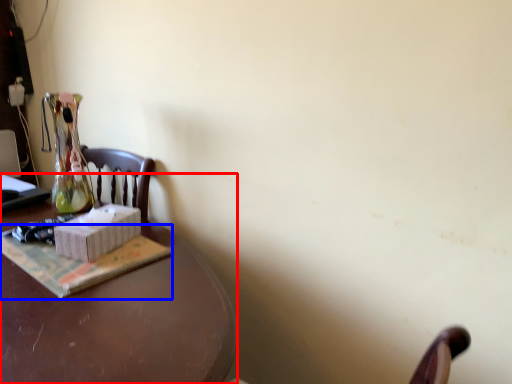
Question: Among these objects, which one is nearest to the camera, desk (highlighted by a red box) or paperback book (highlighted by a blue box)?

Choices:
 (A) desk
 (B) paperback book

Answer: (A)